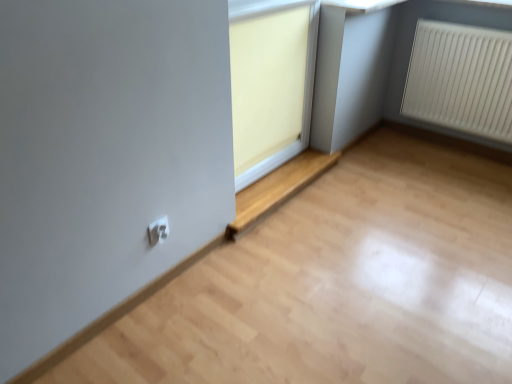
Question: Does white plastic electric outlet at lower center have a lesser width compared to matte wood window at center?

Choices:
 (A) yes
 (B) no

Answer: (A)

Question: Is white plastic electric outlet at lower center positioned behind matte wood window at center?

Choices:
 (A) no
 (B) yes

Answer: (A)

Question: From a real-world perspective, is white plastic electric outlet at lower center positioned over matte wood window at center based on gravity?

Choices:
 (A) no
 (B) yes

Answer: (B)

Question: Can you confirm if white plastic electric outlet at lower center is wider than matte wood window at center?

Choices:
 (A) no
 (B) yes

Answer: (A)

Question: Is white plastic electric outlet at lower center looking in the opposite direction of matte wood window at center?

Choices:
 (A) yes
 (B) no

Answer: (B)

Question: Does point (234, 231) appear closer or farther from the camera than point (264, 152)?

Choices:
 (A) closer
 (B) farther

Answer: (A)

Question: Relative to white plastic window frame at upper center, is matte wood window at center in front or behind?

Choices:
 (A) front
 (B) behind

Answer: (B)

Question: Is matte wood window at center bigger or smaller than white plastic window frame at upper center?

Choices:
 (A) big
 (B) small

Answer: (B)

Question: From the image's perspective, is matte wood window at center above or below white plastic window frame at upper center?

Choices:
 (A) below
 (B) above

Answer: (A)

Question: Would you say white plastic radiator at right is to the left or to the right of white plastic electric outlet at lower center in the picture?

Choices:
 (A) left
 (B) right

Answer: (B)

Question: Considering the positions of point (x=497, y=114) and point (x=165, y=218), is point (x=497, y=114) closer or farther from the camera than point (x=165, y=218)?

Choices:
 (A) farther
 (B) closer

Answer: (A)

Question: From a real-world perspective, relative to white plastic electric outlet at lower center, is white plastic radiator at right vertically above or below?

Choices:
 (A) above
 (B) below

Answer: (A)

Question: Relative to white plastic electric outlet at lower center, is white plastic radiator at right in front or behind?

Choices:
 (A) front
 (B) behind

Answer: (B)

Question: From a real-world perspective, is white plastic radiator at right physically located above or below matte wood window at center?

Choices:
 (A) below
 (B) above

Answer: (B)

Question: Considering the relative positions of white plastic radiator at right and matte wood window at center in the image provided, is white plastic radiator at right to the left or to the right of matte wood window at center?

Choices:
 (A) left
 (B) right

Answer: (B)